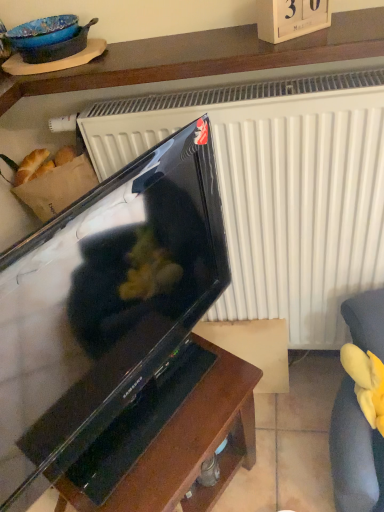
What do you see at coordinates (206, 56) in the screenshot?
I see `wooden shelf at upper center` at bounding box center [206, 56].

What is the approximate height of brown wood table at center?

The height of brown wood table at center is 19.93 inches.

In order to click on wooden shelf at upper center in this screenshot , I will do `click(206, 56)`.

Which object is closer to the camera taking this photo, yellow plush toy at lower right or black glossy television at center?

black glossy television at center is closer to the camera.

Which of these two, yellow plush toy at lower right or black glossy television at center, stands taller?

black glossy television at center.

Find the location of a particular element. food below the black glossy television at center (from the image's perspective) is located at coordinates (366, 382).

Can you confirm if brown wood table at center is shorter than wooden shelf at upper center?

Incorrect, the height of brown wood table at center does not fall short of that of wooden shelf at upper center.

From the picture: Would you say brown wood table at center is to the left or to the right of wooden shelf at upper center in the picture?

Based on their positions, brown wood table at center is located to the left of wooden shelf at upper center.

From the image's perspective, which object appears higher, brown wood table at center or wooden shelf at upper center?

From the image's view, wooden shelf at upper center is above.

Is brown wood table at center oriented towards black glossy television at center?

No, brown wood table at center does not turn towards black glossy television at center.

From a real-world perspective, is brown wood table at center on top of black glossy television at center?

No, from a real-world perspective, brown wood table at center is not over black glossy television at center

Is point (233, 385) farther from camera compared to point (139, 377)?

No, (233, 385) is closer to viewer.

Is black glossy television at center inside brown wood table at center?

Definitely not — black glossy television at center is not inside brown wood table at center.

Locate an element on the screen. The height and width of the screenshot is (512, 384). food positioned vertically above the brown wood table at center (from a real-world perspective) is located at coordinates (366, 382).

Would you consider yellow plush toy at lower right to be distant from brown wood table at center?

No, yellow plush toy at lower right is not far away from brown wood table at center.

Which point is more forward, [375,385] or [239,402]?

Point [239,402]

Could you tell me if yellow plush toy at lower right is turned towards brown wood table at center?

No, yellow plush toy at lower right is not facing towards brown wood table at center.

Can you confirm if black glossy television at center is bigger than yellow plush toy at lower right?

Yes, black glossy television at center is bigger than yellow plush toy at lower right.

Is black glossy television at center far from yellow plush toy at lower right?

black glossy television at center is actually quite close to yellow plush toy at lower right.

Consider the image. Is black glossy television at center turned away from yellow plush toy at lower right?

That's not correct — black glossy television at center is not looking away from yellow plush toy at lower right.

From the image's perspective, which is above, black glossy television at center or wooden shelf at upper center?

From the image's view, wooden shelf at upper center is above.

Consider the image. Between black glossy television at center and wooden shelf at upper center, which one is positioned behind?

Positioned behind is wooden shelf at upper center.

Is wooden shelf at upper center located within black glossy television at center?

Actually, wooden shelf at upper center is outside black glossy television at center.

Considering the relative positions of black glossy television at center and wooden shelf at upper center in the image provided, is black glossy television at center to the right of wooden shelf at upper center from the viewer's perspective?

In fact, black glossy television at center is to the left of wooden shelf at upper center.

Is wooden shelf at upper center positioned beyond the bounds of yellow plush toy at lower right?

Indeed, wooden shelf at upper center is completely outside yellow plush toy at lower right.

Are wooden shelf at upper center and yellow plush toy at lower right beside each other?

No, wooden shelf at upper center is not beside yellow plush toy at lower right.

Find the location of a particular element. This screenshot has width=384, height=512. food below the wooden shelf at upper center (from a real-world perspective) is located at coordinates (366, 382).

Which of these two, wooden shelf at upper center or yellow plush toy at lower right, is wider?

Wider between the two is wooden shelf at upper center.

This screenshot has width=384, height=512. What are the coordinates of `television above the yellow plush toy at lower right (from the image's perspective)` in the screenshot? It's located at (101, 307).

Identify the location of table below the wooden shelf at upper center (from the image's perspective). (188, 446).

Considering their positions, is black glossy television at center positioned closer to yellow plush toy at lower right than wooden shelf at upper center?

black glossy television at center is closer to yellow plush toy at lower right.

Estimate the real-world distances between objects in this image. Which object is further from brown wood table at center, yellow plush toy at lower right or wooden shelf at upper center?

wooden shelf at upper center is positioned further to the anchor brown wood table at center.

Estimate the real-world distances between objects in this image. Which object is further from yellow plush toy at lower right, wooden shelf at upper center or brown wood table at center?

wooden shelf at upper center is further to yellow plush toy at lower right.

Based on their spatial positions, is black glossy television at center or yellow plush toy at lower right further from brown wood table at center?

Based on the image, yellow plush toy at lower right appears to be further to brown wood table at center.

When comparing their distances from wooden shelf at upper center, does brown wood table at center or yellow plush toy at lower right seem closer?

The object closer to wooden shelf at upper center is brown wood table at center.

When comparing their distances from black glossy television at center, does yellow plush toy at lower right or wooden shelf at upper center seem further?

Based on the image, yellow plush toy at lower right appears to be further to black glossy television at center.

Looking at the image, which one is located further to yellow plush toy at lower right, brown wood table at center or black glossy television at center?

Among the two, black glossy television at center is located further to yellow plush toy at lower right.

Looking at the image, which one is located closer to black glossy television at center, brown wood table at center or yellow plush toy at lower right?

brown wood table at center.

Locate an element on the screen. This screenshot has width=384, height=512. table located between black glossy television at center and yellow plush toy at lower right in the left-right direction is located at coordinates (188, 446).

Find the location of a particular element. The height and width of the screenshot is (512, 384). television that lies between wooden shelf at upper center and yellow plush toy at lower right from top to bottom is located at coordinates (101, 307).

The height and width of the screenshot is (512, 384). Find the location of `television between wooden shelf at upper center and brown wood table at center in the up-down direction`. television between wooden shelf at upper center and brown wood table at center in the up-down direction is located at coordinates (101, 307).

Where is `food between wooden shelf at upper center and brown wood table at center from top to bottom`? food between wooden shelf at upper center and brown wood table at center from top to bottom is located at coordinates pos(366,382).